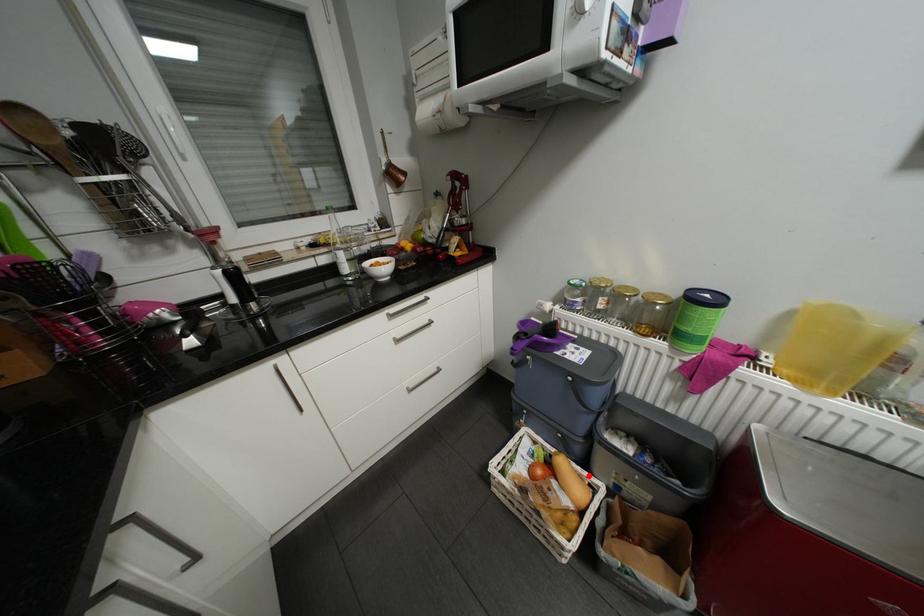
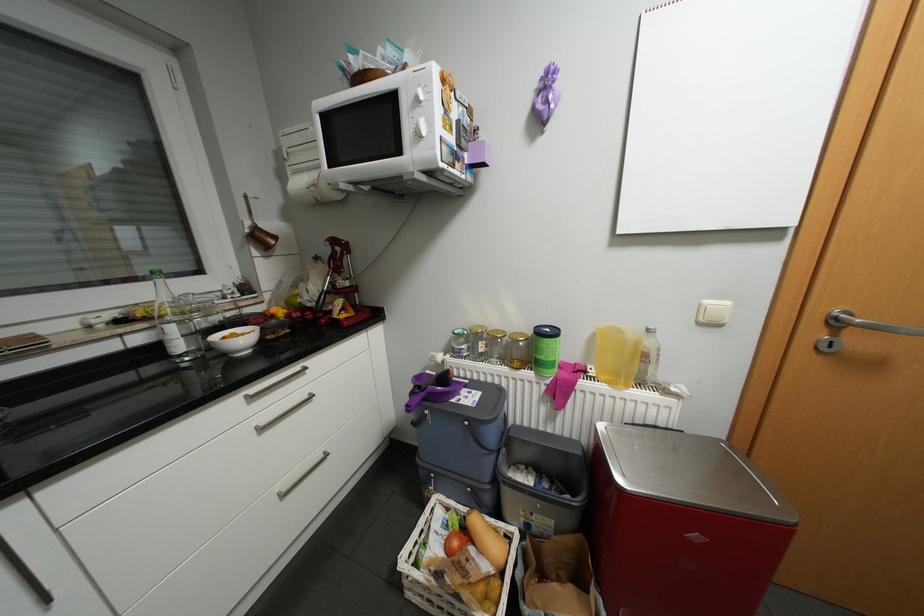
Find the pixel in the second image that matches the highlighted location in the first image.

(504, 528)